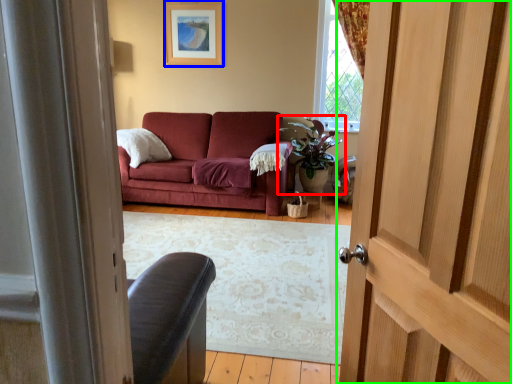
Question: Which is nearer to the houseplant (highlighted by a red box)? picture frame (highlighted by a blue box) or door (highlighted by a green box).

Choices:
 (A) picture frame
 (B) door

Answer: (A)